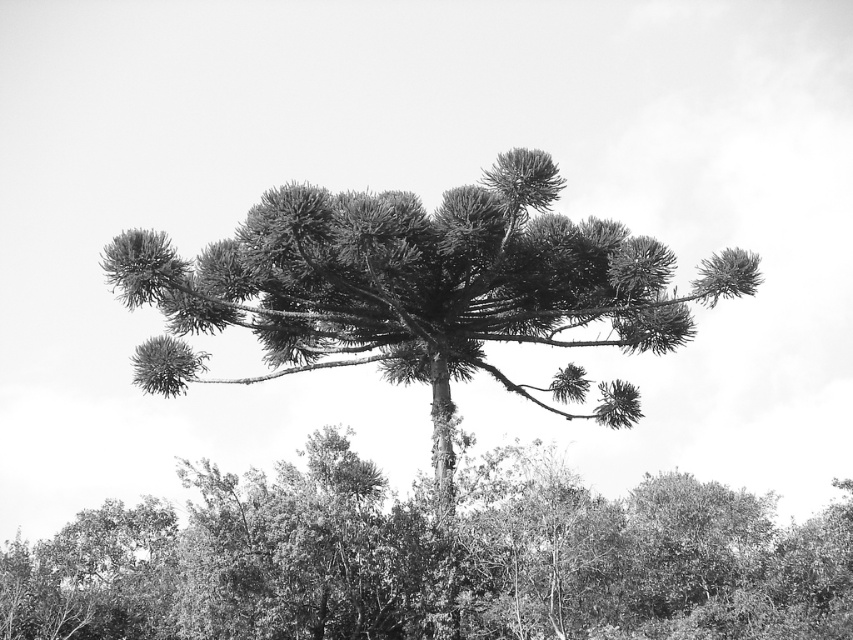
Question: Can you confirm if dark green textured tree at center is positioned to the left of dark green textured pine at center?

Choices:
 (A) yes
 (B) no

Answer: (B)

Question: Is dark green textured tree at center above dark green textured pine at center?

Choices:
 (A) yes
 (B) no

Answer: (B)

Question: Is dark green textured tree at center to the left of dark green textured pine at center from the viewer's perspective?

Choices:
 (A) yes
 (B) no

Answer: (B)

Question: Which object is farther from the camera taking this photo?

Choices:
 (A) dark green textured pine at center
 (B) dark green textured tree at center

Answer: (A)